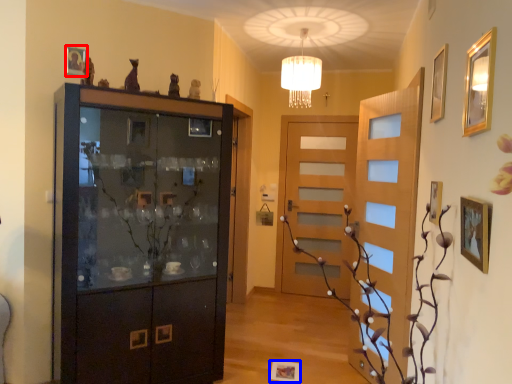
Question: Which object appears closest to the camera in this image, picture frame (highlighted by a red box) or picture frame (highlighted by a blue box)?

Choices:
 (A) picture frame
 (B) picture frame

Answer: (A)